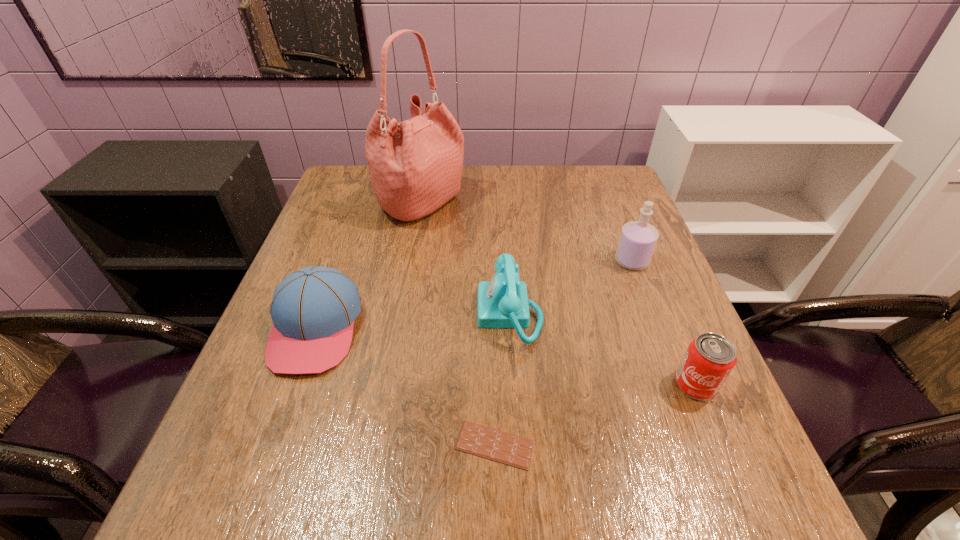
This screenshot has height=540, width=960. I want to click on the tallest object, so click(x=415, y=166).

You are a GUI agent. You are given a task and a screenshot of the screen. Output one action in this format:
    pyautogui.click(x=<x>, y=<y>)
    Task: Click on the handbag
    The height and width of the screenshot is (540, 960).
    Given the screenshot: What is the action you would take?
    pyautogui.click(x=415, y=166)

This screenshot has width=960, height=540. Find the location of `the fifth shortest object`. the fifth shortest object is located at coordinates (638, 239).

Where is `the second farthest object`? The width and height of the screenshot is (960, 540). the second farthest object is located at coordinates (638, 239).

The image size is (960, 540). Identify the location of baseball cap. (313, 309).

At what (x,y) coordinates should I click in order to perform the action: click on telephone. Please return your answer as a coordinate pair (x, y). The width and height of the screenshot is (960, 540). Looking at the image, I should click on (502, 302).

Find the location of `can`. can is located at coordinates (709, 359).

The image size is (960, 540). I want to click on the nearest object, so click(492, 444).

The width and height of the screenshot is (960, 540). Identify the location of the shortest object. (492, 444).

The height and width of the screenshot is (540, 960). I want to click on free region located on the right of the farthest object, so click(536, 204).